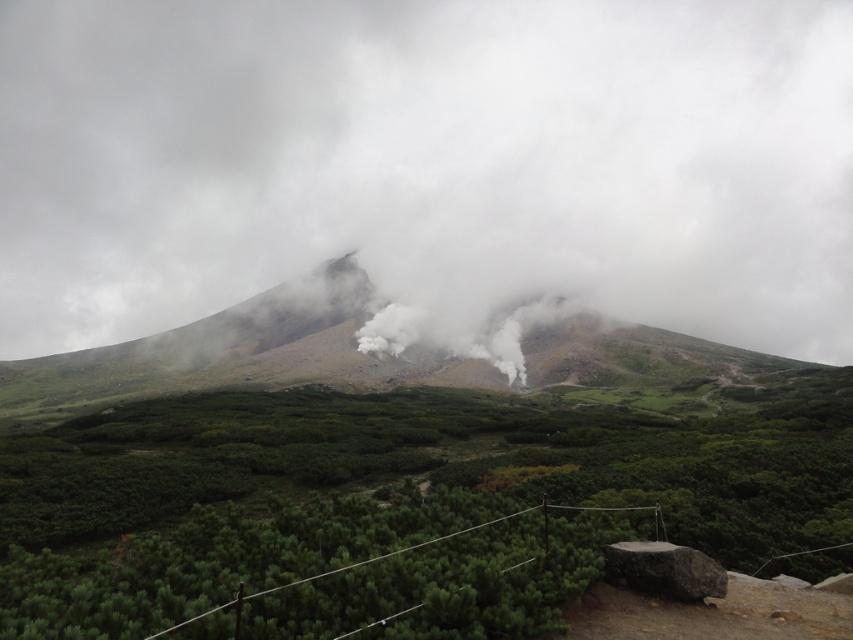
Question: Does white smoke at center have a smaller size compared to green leafy shrubs at center?

Choices:
 (A) no
 (B) yes

Answer: (A)

Question: Is white smoke at center wider than green leafy shrubs at center?

Choices:
 (A) no
 (B) yes

Answer: (B)

Question: Which point appears farthest from the camera in this image?

Choices:
 (A) (78, 531)
 (B) (666, 160)

Answer: (B)

Question: Which object appears closest to the camera in this image?

Choices:
 (A) green leafy shrubs at center
 (B) white smoke at center

Answer: (A)

Question: Which point appears closest to the camera in this image?

Choices:
 (A) (308, 93)
 (B) (426, 396)

Answer: (B)

Question: Does white smoke at center lie behind green leafy shrubs at center?

Choices:
 (A) no
 (B) yes

Answer: (B)